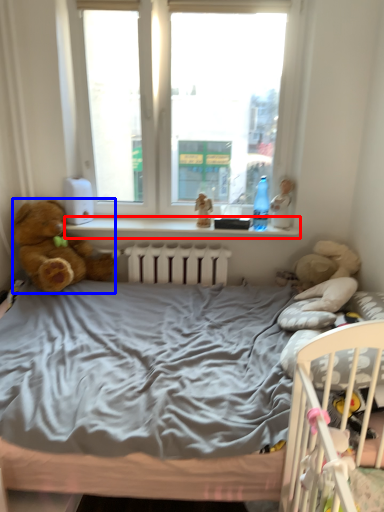
Question: Among these objects, which one is farthest to the camera, window sill (highlighted by a red box) or teddy bear (highlighted by a blue box)?

Choices:
 (A) window sill
 (B) teddy bear

Answer: (A)